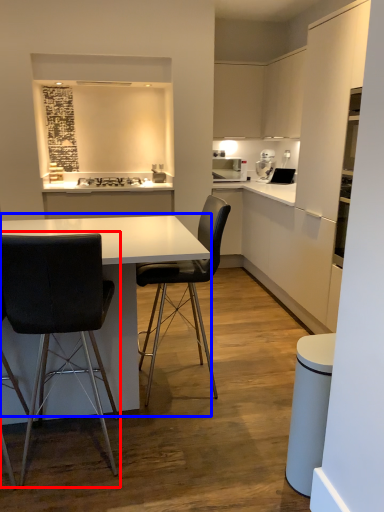
Question: Which object appears closest to the camera in this image, chair (highlighted by a red box) or table (highlighted by a blue box)?

Choices:
 (A) chair
 (B) table

Answer: (A)